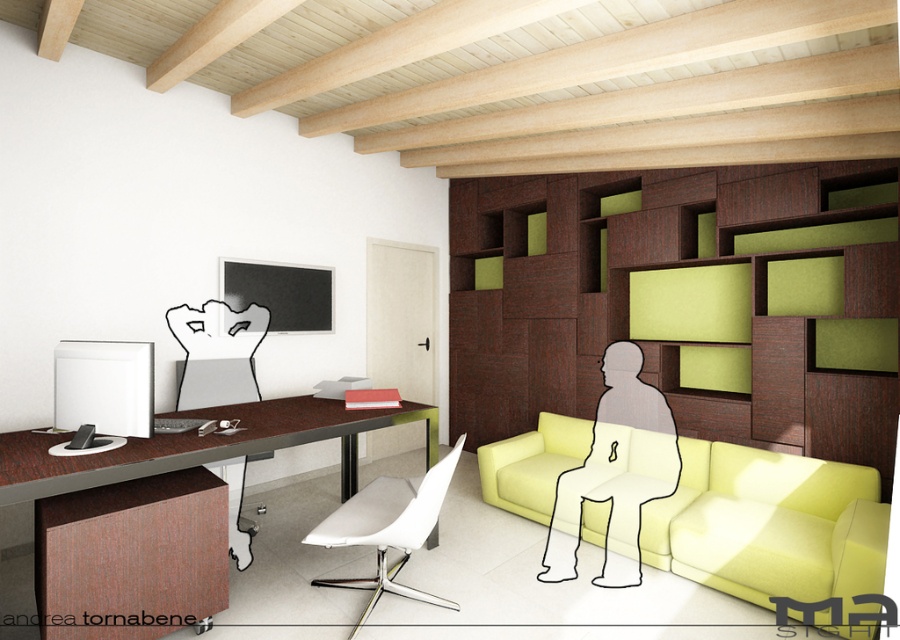
You are standing in the room and want to place a new lamp between the two points, point (x=654, y=499) and point (x=159, y=452). Which point should the lamp be closer to if you want it to be closer to the camera?

The lamp should be closer to point (x=654, y=499) because it is further to the camera than point (x=159, y=452).

You are standing in the room and want to reach both the point at coordinates point (54, 435) and the point at coordinates point (371, 528). Which point will you reach first if you move straight towards them?

You will reach point (54, 435) first because it is closer to you than point (371, 528), which is further away.

You are standing in the middle of the room and want to sit down on the matte yellow couch at center. In which general direction should you walk to reach it?

The matte yellow couch at center is located at point (770, 525), which is towards the lower right side of the room. Since you are standing in the middle, you should walk towards the lower right direction to reach the matte yellow couch at center.